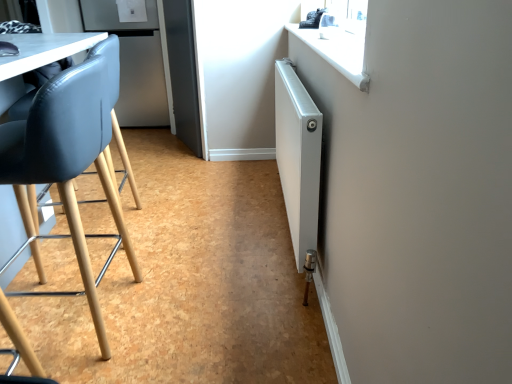
Question: Considering the relative positions of white metallic radiator at right and matte black chair at left in the image provided, is white metallic radiator at right to the right of matte black chair at left from the viewer's perspective?

Choices:
 (A) no
 (B) yes

Answer: (B)

Question: Does white metallic radiator at right come in front of matte black chair at left?

Choices:
 (A) yes
 (B) no

Answer: (B)

Question: From the image's perspective, does white metallic radiator at right appear lower than matte black chair at left?

Choices:
 (A) no
 (B) yes

Answer: (A)

Question: Considering the relative sizes of white metallic radiator at right and matte black chair at left in the image provided, is white metallic radiator at right taller than matte black chair at left?

Choices:
 (A) yes
 (B) no

Answer: (B)

Question: Is the surface of white metallic radiator at right in direct contact with matte black chair at left?

Choices:
 (A) yes
 (B) no

Answer: (B)

Question: In the image, is white metallic radiator at right positioned in front of or behind satin silver refrigerator at upper left?

Choices:
 (A) behind
 (B) front

Answer: (B)

Question: Considering the positions of point (284, 150) and point (150, 29), is point (284, 150) closer or farther from the camera than point (150, 29)?

Choices:
 (A) farther
 (B) closer

Answer: (B)

Question: Considering the positions of white metallic radiator at right and satin silver refrigerator at upper left in the image, is white metallic radiator at right bigger or smaller than satin silver refrigerator at upper left?

Choices:
 (A) small
 (B) big

Answer: (A)

Question: In terms of width, does white metallic radiator at right look wider or thinner when compared to satin silver refrigerator at upper left?

Choices:
 (A) wide
 (B) thin

Answer: (B)

Question: From a real-world perspective, is satin silver refrigerator at upper left physically located above or below white metallic radiator at right?

Choices:
 (A) above
 (B) below

Answer: (A)

Question: Would you say satin silver refrigerator at upper left is inside or outside white metallic radiator at right?

Choices:
 (A) inside
 (B) outside

Answer: (B)

Question: Is satin silver refrigerator at upper left wider or thinner than white metallic radiator at right?

Choices:
 (A) thin
 (B) wide

Answer: (B)

Question: Is point (123, 39) positioned closer to the camera than point (276, 142)?

Choices:
 (A) farther
 (B) closer

Answer: (A)

Question: Considering the positions of point (113, 196) and point (301, 188), is point (113, 196) closer or farther from the camera than point (301, 188)?

Choices:
 (A) farther
 (B) closer

Answer: (A)

Question: Is matte black chair at left taller or shorter than white metallic radiator at right?

Choices:
 (A) short
 (B) tall

Answer: (B)